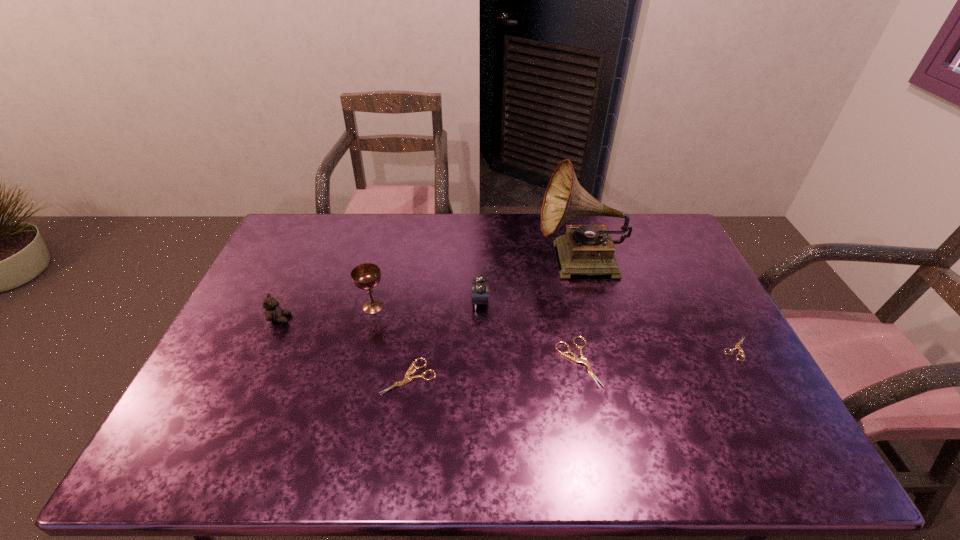
Where is `the sixth tallest object`? The height and width of the screenshot is (540, 960). the sixth tallest object is located at coordinates (407, 379).

Identify the location of the leftmost shears. The height and width of the screenshot is (540, 960). (407, 379).

The height and width of the screenshot is (540, 960). I want to click on the second shears from right to left, so click(575, 358).

Image resolution: width=960 pixels, height=540 pixels. I want to click on the rightmost object, so click(737, 346).

What are the coordinates of `the shortest shears` in the screenshot? It's located at (737, 346).

This screenshot has width=960, height=540. Find the location of `the farthest object`. the farthest object is located at coordinates (585, 249).

Locate an element on the screen. record player is located at coordinates (585, 249).

Identify the location of teddy bear. This screenshot has width=960, height=540. (273, 313).

Locate an element on the screen. This screenshot has width=960, height=540. the fourth object from right to left is located at coordinates (480, 286).

You are a GUI agent. You are given a task and a screenshot of the screen. Output one action in this format:
    pyautogui.click(x=<x>, y=<y>)
    Task: Click on the second object from left to right
    The image size is (960, 540).
    Given the screenshot: What is the action you would take?
    pyautogui.click(x=366, y=276)